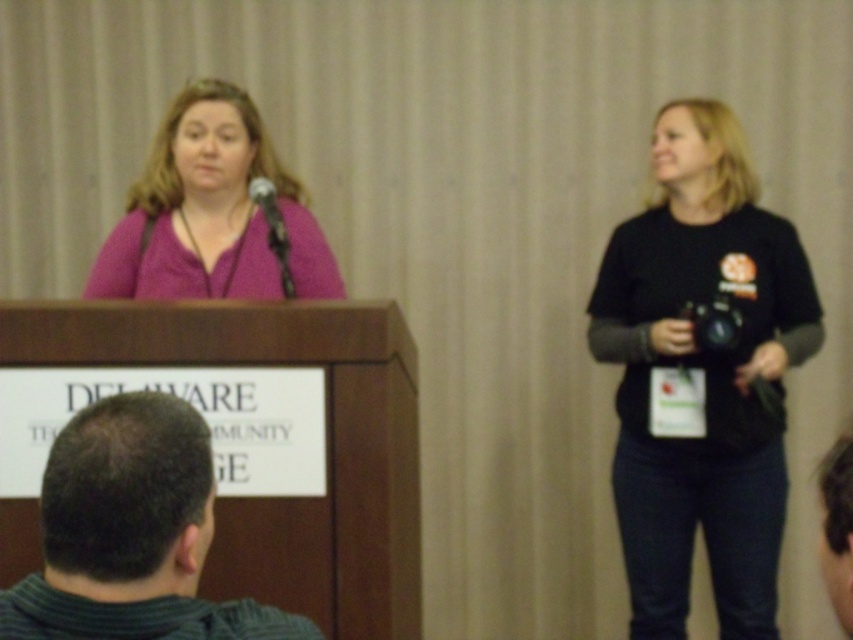
Does black matte shirt at right appear on the left side of matte pink shirt at center?

Incorrect, black matte shirt at right is not on the left side of matte pink shirt at center.

Can you confirm if black matte shirt at right is smaller than matte pink shirt at center?

No.

Between point (759, 454) and point (274, 154), which one is positioned in front?

Point (274, 154)

Where is `black matte shirt at right`? The image size is (853, 640). black matte shirt at right is located at coordinates (700, 376).

Between black matte shirt at right and matte black microphone at center, which one has less height?

With less height is matte black microphone at center.

Is point (689, 131) closer to camera compared to point (251, 189)?

That is False.

Find the location of `black matte shirt at right`. black matte shirt at right is located at coordinates (700, 376).

The height and width of the screenshot is (640, 853). What do you see at coordinates (837, 529) in the screenshot?
I see `dark brown hair at lower right` at bounding box center [837, 529].

Can you confirm if dark brown hair at lower right is bigger than matte black microphone at center?

Correct, dark brown hair at lower right is larger in size than matte black microphone at center.

Is point (827, 579) closer to viewer compared to point (262, 177)?

Yes.

The image size is (853, 640). Find the location of `dark brown hair at lower right`. dark brown hair at lower right is located at coordinates (837, 529).